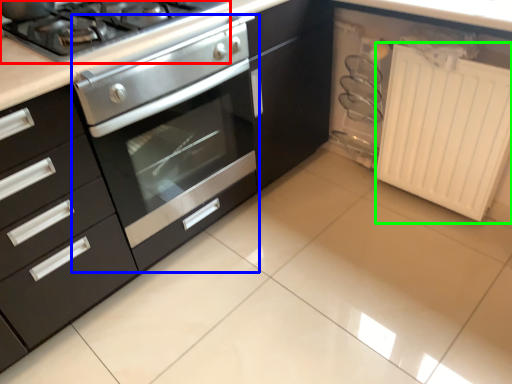
Question: Considering the real-world distances, which object is closest to gas stove (highlighted by a red box)? oven (highlighted by a blue box) or radiator (highlighted by a green box).

Choices:
 (A) oven
 (B) radiator

Answer: (A)